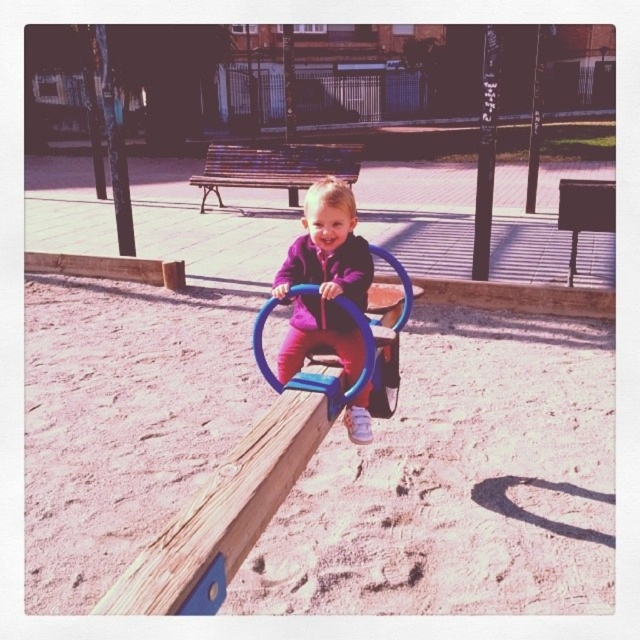
You are standing at the playground and want to walk from the seesaw to the bench. The seesaw is located at point (323, 216) and the bench is at point (364, 321). Which point is closer to you as you start walking?

Point (323, 216) is closer to you because it is further to the viewer than point (364, 321).

You are standing at the playground and want to place a new trash can. You have two points marked on the map as point 1 at coordinates point (244,563) and point 2 at coordinates point (410,289). Which point is closer to you where you can place the trash can?

Point (244,563) is closer to the viewer than point (410,289), so you should place the trash can at point (244,563).